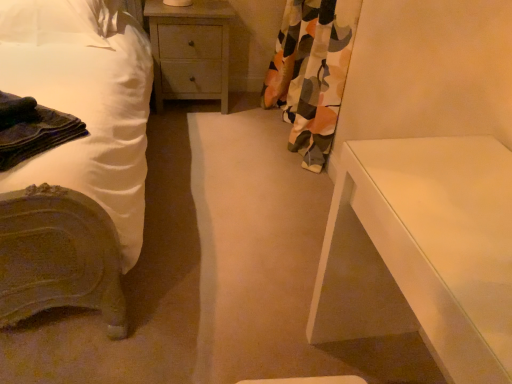
Question: Are white fabric pillow at upper left and dark blue fabric at left making contact?

Choices:
 (A) no
 (B) yes

Answer: (A)

Question: Is white fabric pillow at upper left located outside dark blue fabric at left?

Choices:
 (A) no
 (B) yes

Answer: (B)

Question: Is white fabric pillow at upper left positioned with its back to dark blue fabric at left?

Choices:
 (A) yes
 (B) no

Answer: (B)

Question: Can you confirm if white fabric pillow at upper left is thinner than dark blue fabric at left?

Choices:
 (A) no
 (B) yes

Answer: (A)

Question: Is white fabric pillow at upper left in front of dark blue fabric at left?

Choices:
 (A) no
 (B) yes

Answer: (A)

Question: Considering the positions of wooden nightstand at center and dark blue fabric at left in the image, is wooden nightstand at center taller or shorter than dark blue fabric at left?

Choices:
 (A) short
 (B) tall

Answer: (B)

Question: Is wooden nightstand at center situated inside dark blue fabric at left or outside?

Choices:
 (A) inside
 (B) outside

Answer: (B)

Question: Is point (155, 29) closer or farther from the camera than point (69, 135)?

Choices:
 (A) closer
 (B) farther

Answer: (B)

Question: Looking at the image, does wooden nightstand at center seem bigger or smaller compared to dark blue fabric at left?

Choices:
 (A) small
 (B) big

Answer: (B)

Question: Would you say white smooth table at right is to the left or to the right of wooden nightstand at center in the picture?

Choices:
 (A) right
 (B) left

Answer: (A)

Question: From the image's perspective, is white smooth table at right located above or below wooden nightstand at center?

Choices:
 (A) above
 (B) below

Answer: (B)

Question: Considering the positions of white smooth table at right and wooden nightstand at center in the image, is white smooth table at right wider or thinner than wooden nightstand at center?

Choices:
 (A) wide
 (B) thin

Answer: (A)

Question: From their relative heights in the image, would you say white smooth table at right is taller or shorter than wooden nightstand at center?

Choices:
 (A) tall
 (B) short

Answer: (A)

Question: Visually, is wooden nightstand at center positioned to the left or to the right of floral fabric curtain at right?

Choices:
 (A) left
 (B) right

Answer: (A)

Question: From a real-world perspective, is wooden nightstand at center physically located above or below floral fabric curtain at right?

Choices:
 (A) below
 (B) above

Answer: (A)